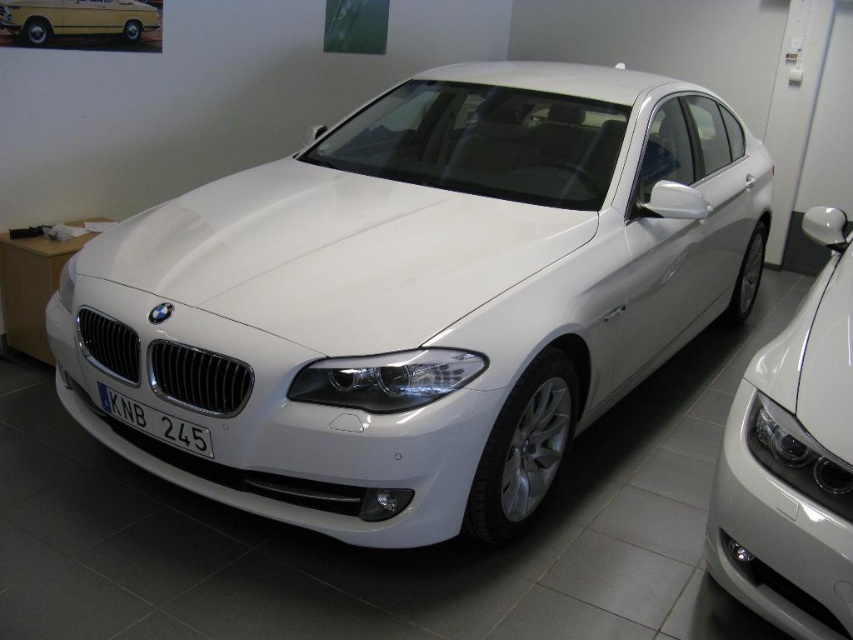
You are standing in a showroom and see the white metallic car at center. There is a point marked at coordinates (421, 296). What is located at that point?

The point at coordinates (421, 296) is where the white metallic car at center is located.

You are a customer looking to test drive the white metallic car at center and the yellow matte car at upper left. Since both cars are parked in the same garage, can you determine which car is closer to you based on their positions?

The white metallic car at center is closer to you because it is in front of the yellow matte car at upper left, meaning the yellow matte car is further back in the garage.